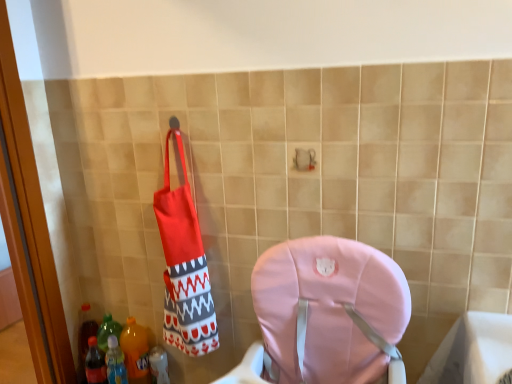
Question: From a real-world perspective, is translucent plastic bottle at lower left, which is the 3th bottle from left to right, beneath translucent plastic bottle at lower left, the first bottle positioned from the left?

Choices:
 (A) yes
 (B) no

Answer: (A)

Question: Could you tell me if translucent plastic bottle at lower left, which is the 3th bottle from left to right, is facing translucent plastic bottle at lower left, the first bottle positioned from the left?

Choices:
 (A) no
 (B) yes

Answer: (A)

Question: Is translucent plastic bottle at lower left, which is the 3th bottle from left to right, in front of translucent plastic bottle at lower left, which is counted as the third bottle, starting from the right?

Choices:
 (A) yes
 (B) no

Answer: (B)

Question: From the image's perspective, would you say translucent plastic bottle at lower left, which is the 3th bottle from left to right, is shown under translucent plastic bottle at lower left, which is counted as the third bottle, starting from the right?

Choices:
 (A) yes
 (B) no

Answer: (A)

Question: Is translucent plastic bottle at lower left, which is the 3th bottle from left to right, touching translucent plastic bottle at lower left, the first bottle positioned from the left?

Choices:
 (A) yes
 (B) no

Answer: (B)

Question: Considering the relative sizes of translucent plastic bottle at lower left, the 1th bottle from the right, and translucent plastic bottle at lower left, which is counted as the third bottle, starting from the right, in the image provided, is translucent plastic bottle at lower left, the 1th bottle from the right, thinner than translucent plastic bottle at lower left, which is counted as the third bottle, starting from the right,?

Choices:
 (A) no
 (B) yes

Answer: (A)

Question: From a real-world perspective, is translucent plastic bottle at lower left, which is counted as the third bottle, starting from the right, located higher than translucent plastic bottle at lower left, which is the second bottle in left-to-right order?

Choices:
 (A) yes
 (B) no

Answer: (B)

Question: Does translucent plastic bottle at lower left, which is counted as the third bottle, starting from the right, come in front of translucent plastic bottle at lower left, which is the second bottle in left-to-right order?

Choices:
 (A) no
 (B) yes

Answer: (B)

Question: From the image's perspective, is translucent plastic bottle at lower left, the first bottle positioned from the left, beneath translucent plastic bottle at lower left, acting as the 2th bottle starting from the right?

Choices:
 (A) no
 (B) yes

Answer: (B)

Question: Is translucent plastic bottle at lower left, acting as the 2th bottle starting from the right, surrounded by translucent plastic bottle at lower left, which is counted as the third bottle, starting from the right?

Choices:
 (A) yes
 (B) no

Answer: (B)

Question: Would you say translucent plastic bottle at lower left, the first bottle positioned from the left, is a long distance from translucent plastic bottle at lower left, which is the second bottle in left-to-right order?

Choices:
 (A) no
 (B) yes

Answer: (A)

Question: From the image's perspective, would you say translucent plastic bottle at lower left, which is counted as the third bottle, starting from the right, is positioned over translucent plastic bottle at lower left, acting as the 2th bottle starting from the right?

Choices:
 (A) yes
 (B) no

Answer: (B)

Question: Does translucent plastic bottle at lower left, the 1th bottle from the right, lie behind translucent plastic bottle at lower left, which is the second bottle in left-to-right order?

Choices:
 (A) no
 (B) yes

Answer: (B)